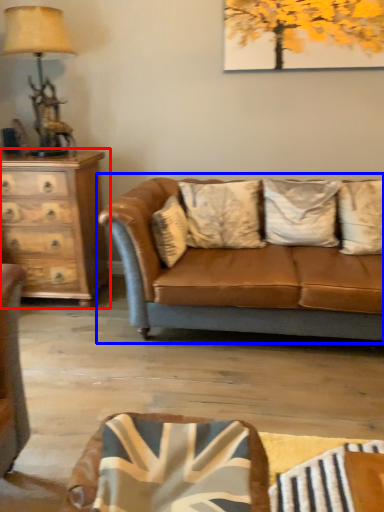
Question: Among these objects, which one is nearest to the camera, chest of drawers (highlighted by a red box) or studio couch (highlighted by a blue box)?

Choices:
 (A) chest of drawers
 (B) studio couch

Answer: (B)